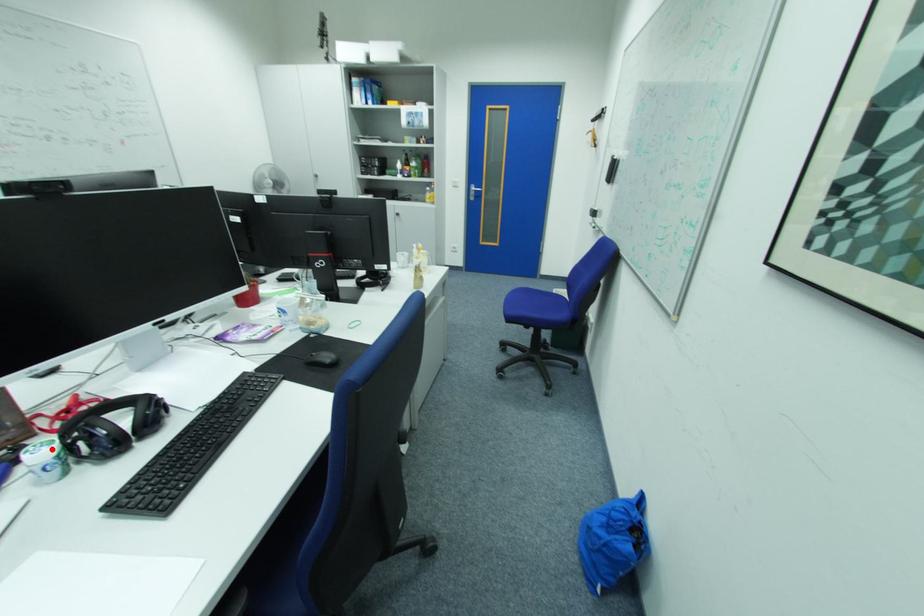
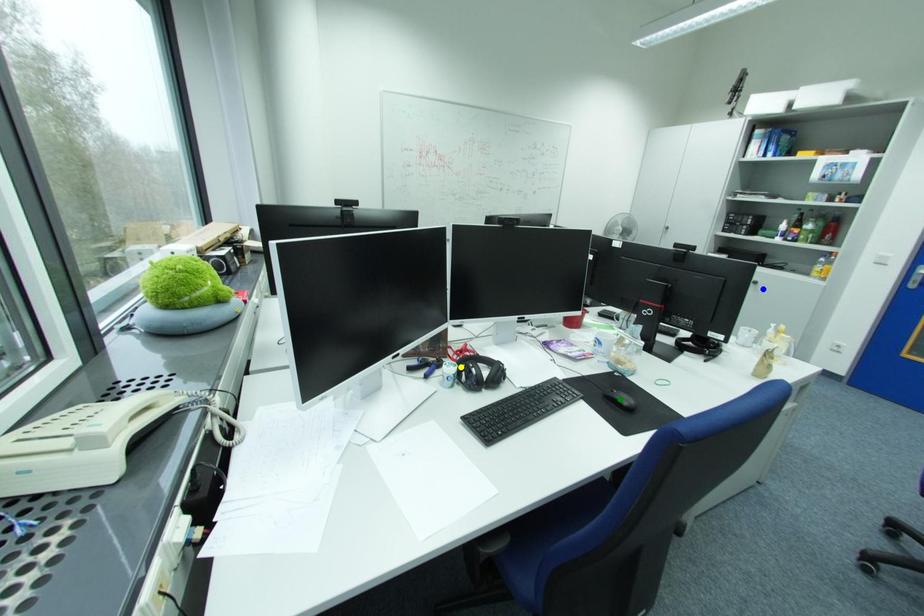
Question: I am providing you with two images of the same scene from different viewpoints. A red point is marked on the first image. You are given multiple points on the second image. Which spot in image 2 lines up with the point in image 1?

Choices:
 (A) blue point
 (B) yellow point
 (C) green point

Answer: (B)